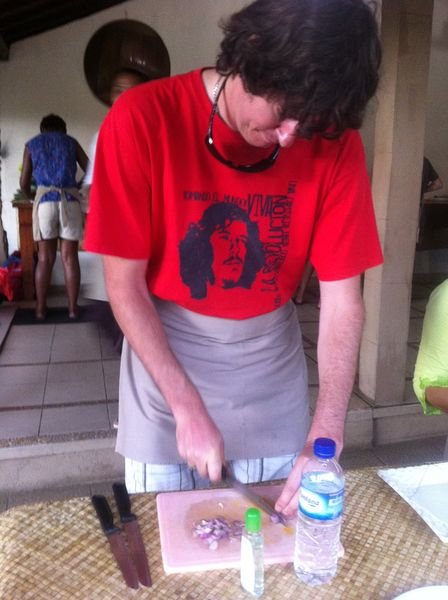
At what (x,y) coordinates should I click in order to perform the action: click on 3 knives. Please return your answer as a coordinate pair (x, y). The width and height of the screenshot is (448, 600). Looking at the image, I should click on (117, 551), (142, 551), (253, 494).